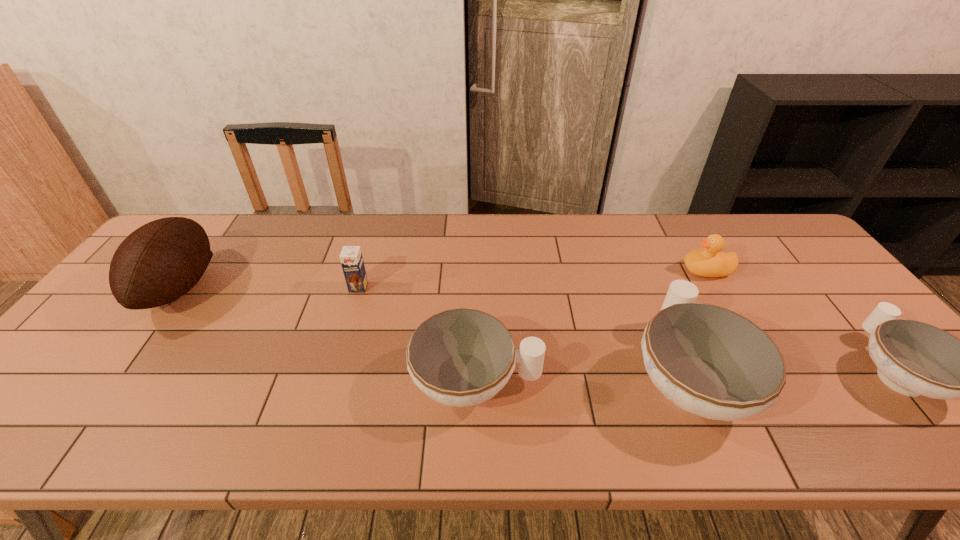
Identify the location of the third object from left to right. This screenshot has width=960, height=540. (462, 357).

This screenshot has height=540, width=960. I want to click on the second shortest chinaware, so click(x=462, y=357).

Where is `the second chinaware from right to left`? This screenshot has width=960, height=540. the second chinaware from right to left is located at coordinates (710, 361).

I want to click on the leftmost object, so click(x=159, y=262).

Identify the location of the tallest object. The image size is (960, 540). (159, 262).

Locate an element on the screen. chocolate milk is located at coordinates (351, 259).

The height and width of the screenshot is (540, 960). I want to click on duck, so click(x=707, y=262).

Where is `vacant space located on the side with the handle of the second shortest chinaware`? vacant space located on the side with the handle of the second shortest chinaware is located at coordinates (588, 382).

The height and width of the screenshot is (540, 960). I want to click on vacant space located on the side with the handle of the second chinaware from left to right, so click(x=653, y=295).

Locate an element on the screen. Image resolution: width=960 pixels, height=540 pixels. vacant space located 0.210m on the side with the handle of the second chinaware from left to right is located at coordinates (642, 269).